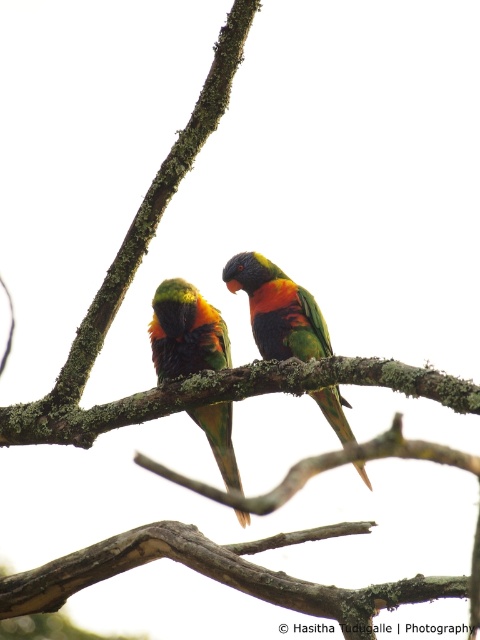
You are a birdwatcher with a camera that has a minimum focus distance of 10 inches. You spot the multicolored feathered parrot at center and the rainbow feathered parrot at center in the image. Can your camera focus on both birds simultaneously?

The distance between the multicolored feathered parrot at center and the rainbow feathered parrot at center is 12.95 inches. Since the minimum focus distance is 10 inches, the camera can focus on both birds as the distance between them is greater than the minimum requirement.

You are a birdwatcher trying to capture both birds in a single photo. The camera you are using has a maximum focus range of 4 meters. Can you fit both the multicolored feathered parrot at center and the other bird in your photo without moving the camera?

The multicolored feathered parrot at center and the other bird are 4.28 meters apart. Since the camera can only focus up to 4 meters, the distance between them exceeds the camera range. Therefore, you cannot capture both birds in one photo without moving the camera.

You are a birdwatcher trying to capture both birds in your camera frame. The multicolored feathered parrot at center and the rainbow feathered parrot at center are both in the center. Since your camera can only focus on one bird at a time, which bird should you adjust the focus for first if you want to ensure the wider bird is in focus?

The rainbow feathered parrot at center is wider than the multicolored feathered parrot at center. Therefore, you should first adjust the focus for the rainbow feathered parrot at center to ensure it is in focus since it is wider.